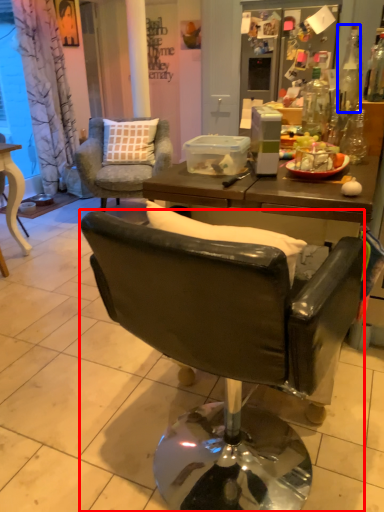
Question: Which object appears closest to the camera in this image, chair (highlighted by a red box) or bottle (highlighted by a blue box)?

Choices:
 (A) chair
 (B) bottle

Answer: (A)